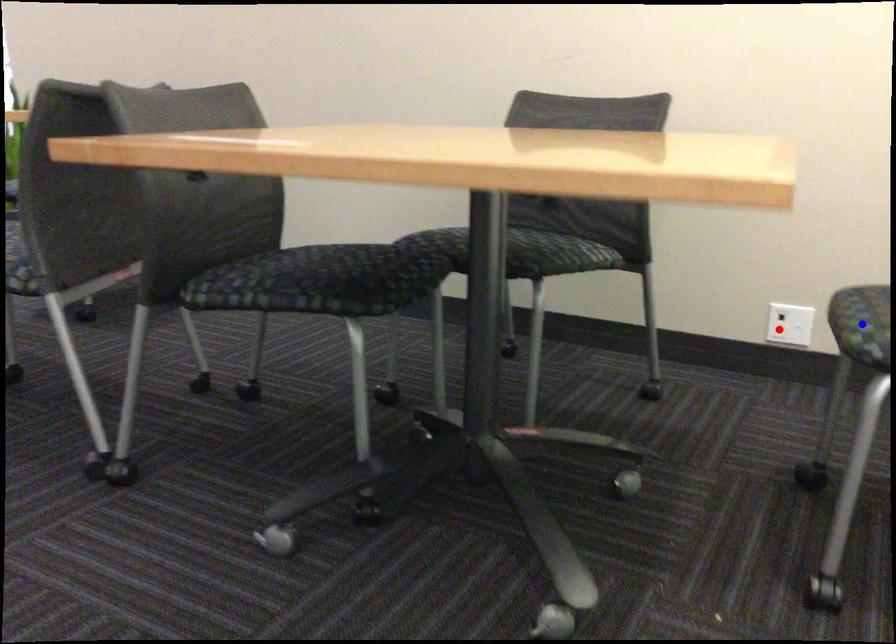
Question: Two points are marked on the image. Which point is closer to the camera?

Choices:
 (A) Blue point is closer.
 (B) Red point is closer.

Answer: (A)